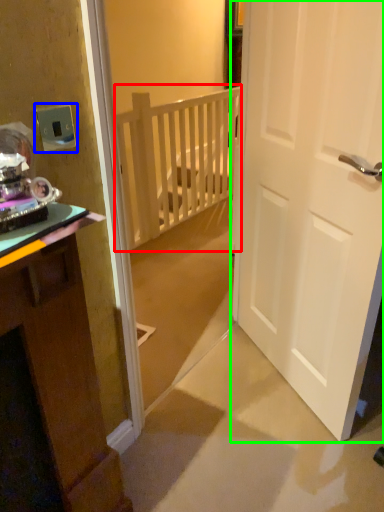
Question: Considering the real-world distances, which object is closest to balustrade (highlighted by a red box)? electric outlet (highlighted by a blue box) or door (highlighted by a green box).

Choices:
 (A) electric outlet
 (B) door

Answer: (B)